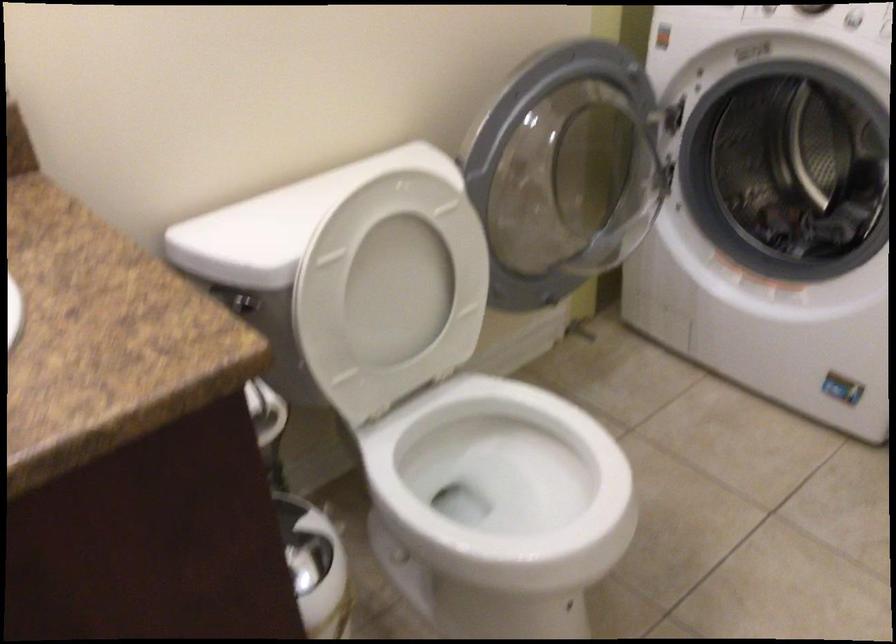
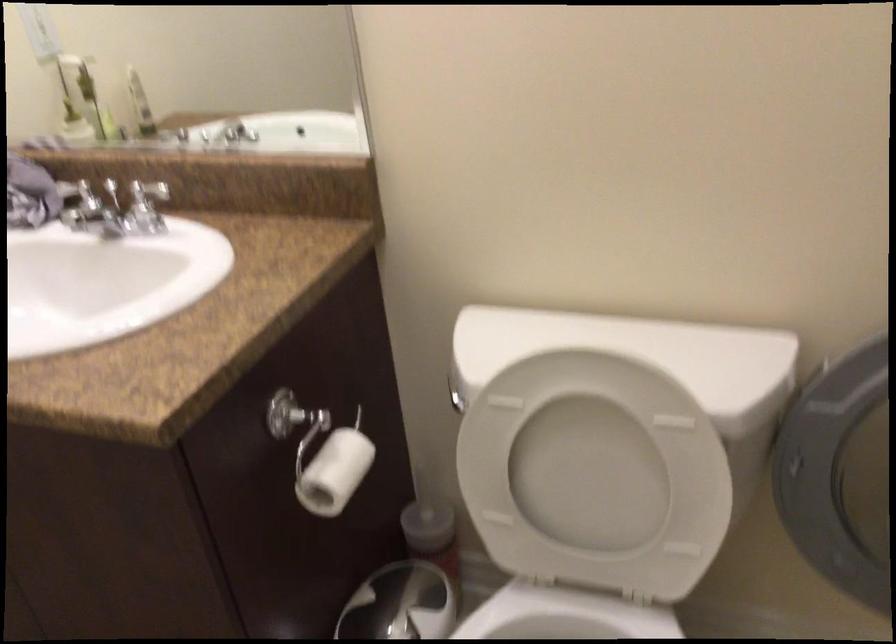
Question: Based on the continuous images, in which direction is the camera rotating? Reply with the corresponding letter.

Choices:
 (A) Left
 (B) Right
 (C) Up
 (D) Down

Answer: (A)